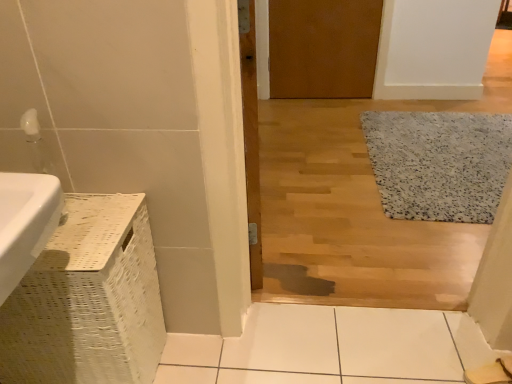
The image size is (512, 384). I want to click on free spot in front of brown matte door at upper center, the second door in the bottom-to-top sequence, so click(x=320, y=120).